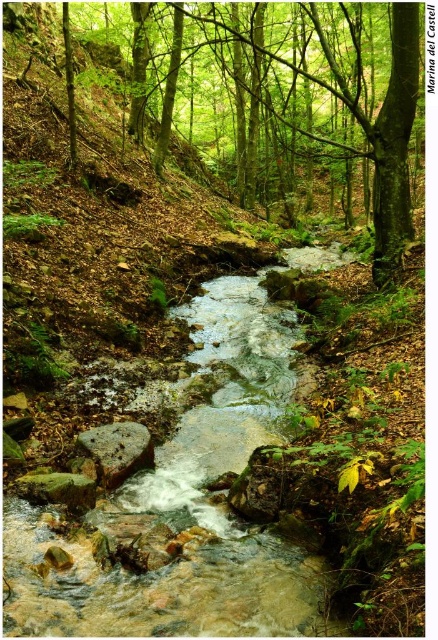
Which is above, green leafy tree at center or smooth gray rock at center?

green leafy tree at center is higher up.

Between point (134, 32) and point (130, 429), which one is positioned behind?

Positioned behind is point (134, 32).

Which is behind, point (218, 68) or point (110, 476)?

Point (218, 68)

At what (x,y) coordinates should I click in order to perform the action: click on green leafy tree at center. Please return your answer as a coordinate pair (x, y). The image size is (438, 640). Looking at the image, I should click on (279, 97).